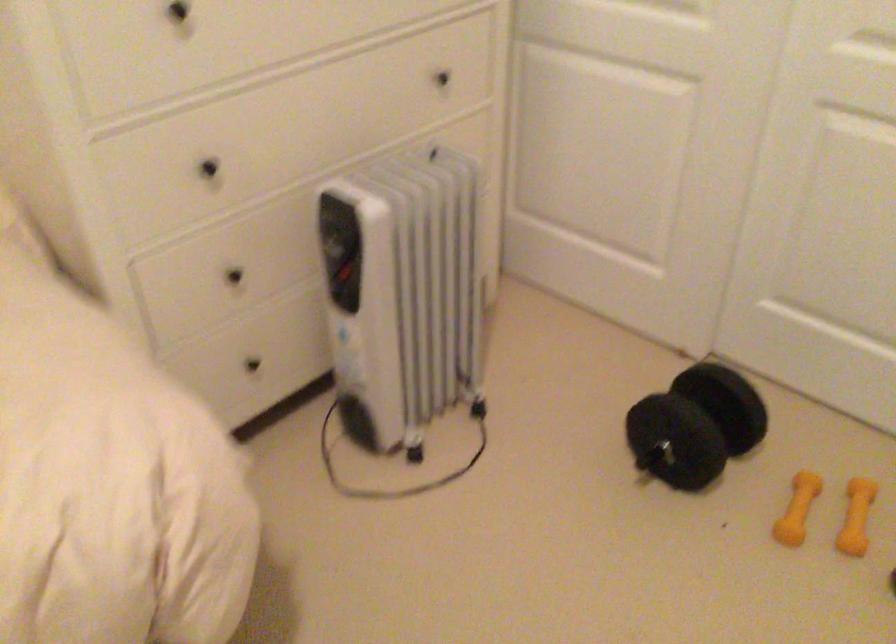
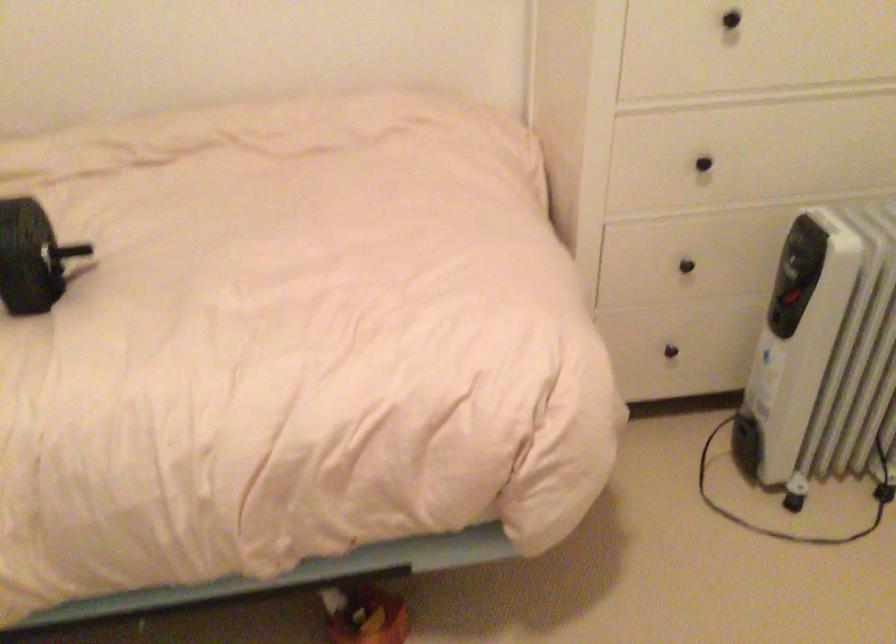
In the second image, find the point that corresponds to [478,412] in the first image.

(883, 491)